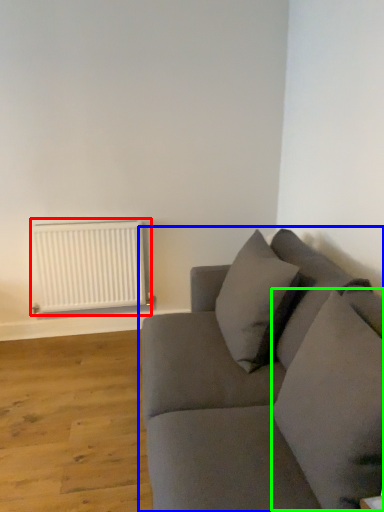
Question: Which object is positioned farthest from radiator (highlighted by a red box)? Select from studio couch (highlighted by a blue box) and pillow (highlighted by a green box).

Choices:
 (A) studio couch
 (B) pillow

Answer: (B)